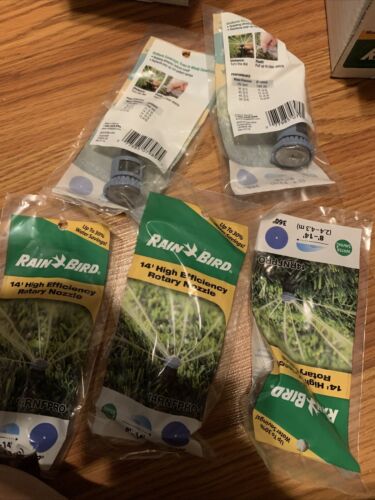
What are the coordinates of `box corner` in the screenshot? It's located at (333, 69).